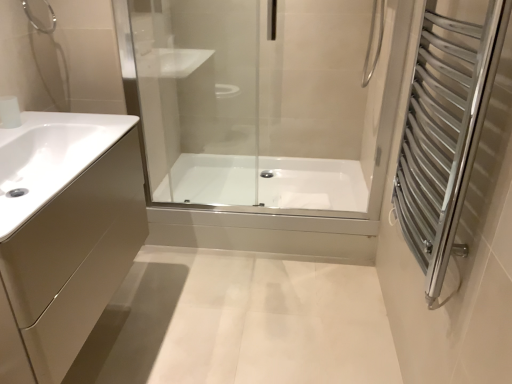
Locate an element on the screen. The height and width of the screenshot is (384, 512). free point to the right of white glossy faucet at upper left is located at coordinates (52, 123).